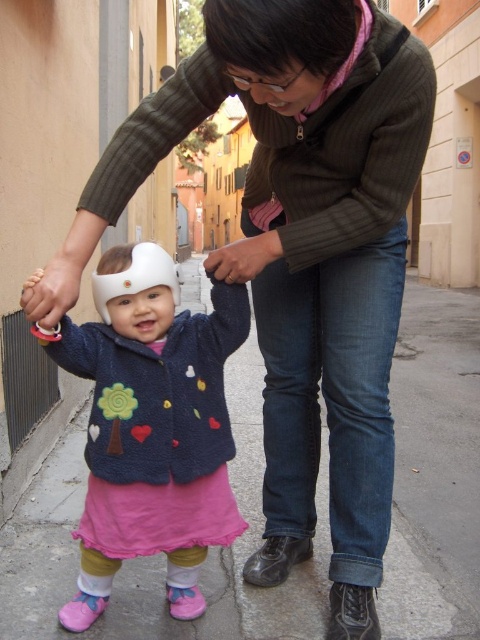
Question: Which object appears closest to the camera in this image?

Choices:
 (A) fuzzy blue jacket at center
 (B) matte brown hand at center
 (C) gray concrete pavement at lower center
 (D) matte white helmet at upper left

Answer: (D)

Question: Is gray concrete pavement at lower center positioned before matte brown hand at center?

Choices:
 (A) no
 (B) yes

Answer: (A)

Question: Where is gray concrete pavement at lower center located in relation to matte brown hand at center in the image?

Choices:
 (A) left
 (B) right

Answer: (B)

Question: Is matte white helmet at upper left to the left of matte brown hand at center from the viewer's perspective?

Choices:
 (A) no
 (B) yes

Answer: (B)

Question: Which object appears farthest from the camera in this image?

Choices:
 (A) matte white helmet at upper left
 (B) matte brown hand at center
 (C) fuzzy blue jacket at center

Answer: (B)

Question: Which object is positioned farthest from the matte white helmet at upper left?

Choices:
 (A) fuzzy blue jacket at center
 (B) gray concrete pavement at lower center

Answer: (B)